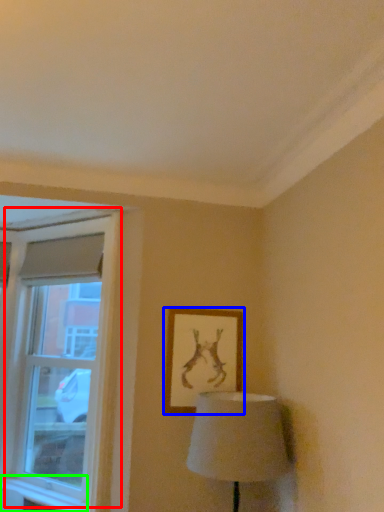
Question: Which object is the farthest from window (highlighted by a red box)? Choose among these: picture frame (highlighted by a blue box) or window sill (highlighted by a green box).

Choices:
 (A) picture frame
 (B) window sill

Answer: (A)